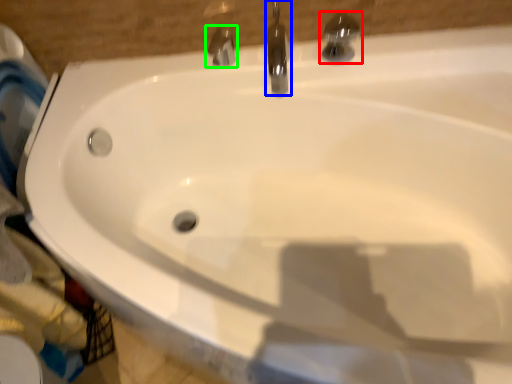
Question: Estimate the real-world distances between objects in this image. Which object is closer to tap (highlighted by a red box), tap (highlighted by a blue box) or tap (highlighted by a green box)?

Choices:
 (A) tap
 (B) tap

Answer: (A)